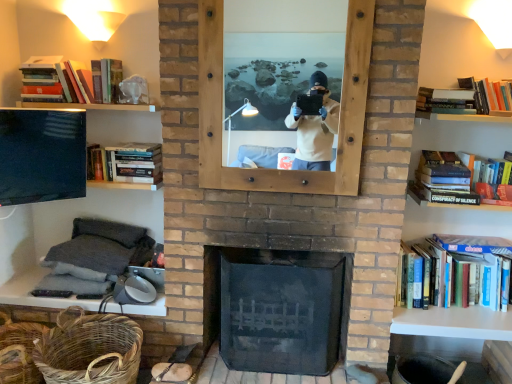
Question: Is hardcover book at left, the third book from the bottom, smaller than dark gray fabric at lower left?

Choices:
 (A) yes
 (B) no

Answer: (A)

Question: Does hardcover book at left, which ranks as the fourth book in right-to-left order, have a greater width compared to dark gray fabric at lower left?

Choices:
 (A) no
 (B) yes

Answer: (A)

Question: Does hardcover book at left, which is counted as the third book, starting from the top, contain dark gray fabric at lower left?

Choices:
 (A) no
 (B) yes

Answer: (A)

Question: Is hardcover book at left, which is counted as the 2th book, starting from the left, facing towards dark gray fabric at lower left?

Choices:
 (A) no
 (B) yes

Answer: (A)

Question: Is hardcover book at left, which is counted as the 2th book, starting from the left, positioned with its back to dark gray fabric at lower left?

Choices:
 (A) no
 (B) yes

Answer: (A)

Question: Is hardcover book at right, arranged as the fourth book when viewed from the top, in front of or behind wooden mirror at center in the image?

Choices:
 (A) front
 (B) behind

Answer: (B)

Question: Is point (444, 190) positioned closer to the camera than point (214, 81)?

Choices:
 (A) farther
 (B) closer

Answer: (A)

Question: Based on their positions, is hardcover book at right, which appears as the third book when viewed from the right, located to the left or right of wooden mirror at center?

Choices:
 (A) left
 (B) right

Answer: (B)

Question: From the image's perspective, is hardcover book at right, arranged as the fourth book when viewed from the top, above or below wooden mirror at center?

Choices:
 (A) below
 (B) above

Answer: (A)

Question: In the image, is black glass fireplace at center positioned in front of or behind woven brown basket at lower left, the 2th basket in the left-to-right sequence?

Choices:
 (A) front
 (B) behind

Answer: (B)

Question: In the image, is black glass fireplace at center on the left side or the right side of woven brown basket at lower left, the 2th basket in the left-to-right sequence?

Choices:
 (A) left
 (B) right

Answer: (B)

Question: Looking at the image, does black glass fireplace at center seem bigger or smaller compared to woven brown basket at lower left, the 2th basket in the left-to-right sequence?

Choices:
 (A) big
 (B) small

Answer: (A)

Question: From the image's perspective, relative to woven brown basket at lower left, the 2th basket in the left-to-right sequence, is black glass fireplace at center above or below?

Choices:
 (A) below
 (B) above

Answer: (B)

Question: From a real-world perspective, is woven natural basket at lower left, the first basket positioned from the left, positioned above or below wooden mirror at center?

Choices:
 (A) below
 (B) above

Answer: (A)

Question: Is woven natural basket at lower left, the first basket positioned from the left, inside or outside of wooden mirror at center?

Choices:
 (A) inside
 (B) outside

Answer: (B)